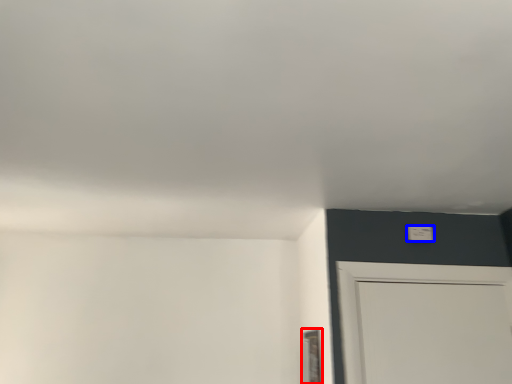
Question: Among these objects, which one is farthest to the camera, window (highlighted by a red box) or light switch (highlighted by a blue box)?

Choices:
 (A) window
 (B) light switch

Answer: (B)